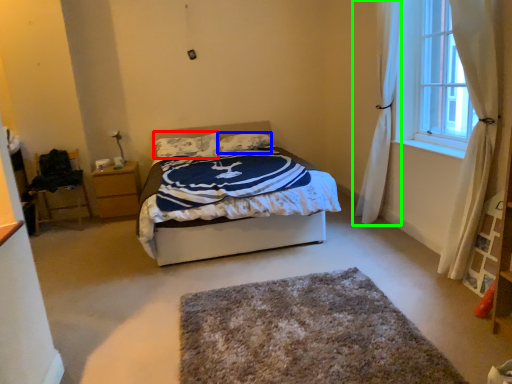
Question: Which is farther away from pillow (highlighted by a red box)? pillow (highlighted by a blue box) or curtain (highlighted by a green box)?

Choices:
 (A) pillow
 (B) curtain

Answer: (B)